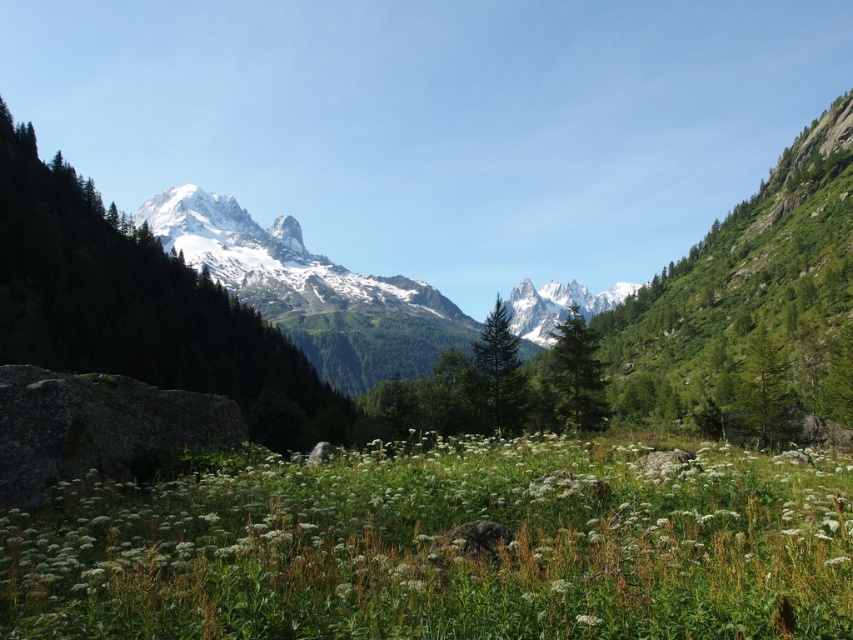
Can you confirm if green leafy plant at center is positioned to the left of white snow-covered mountain range at center?

Yes, green leafy plant at center is to the left of white snow-covered mountain range at center.

Which is behind, point (326, 556) or point (300, 321)?

The point (300, 321) is more distant.

The image size is (853, 640). In order to click on green leafy plant at center in this screenshot , I will do `click(444, 545)`.